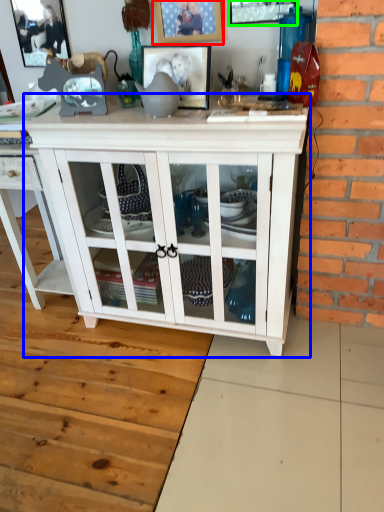
Question: Which object is positioned closest to picture frame (highlighted by a red box)? Select from cupboard (highlighted by a blue box) and picture frame (highlighted by a green box).

Choices:
 (A) cupboard
 (B) picture frame

Answer: (B)